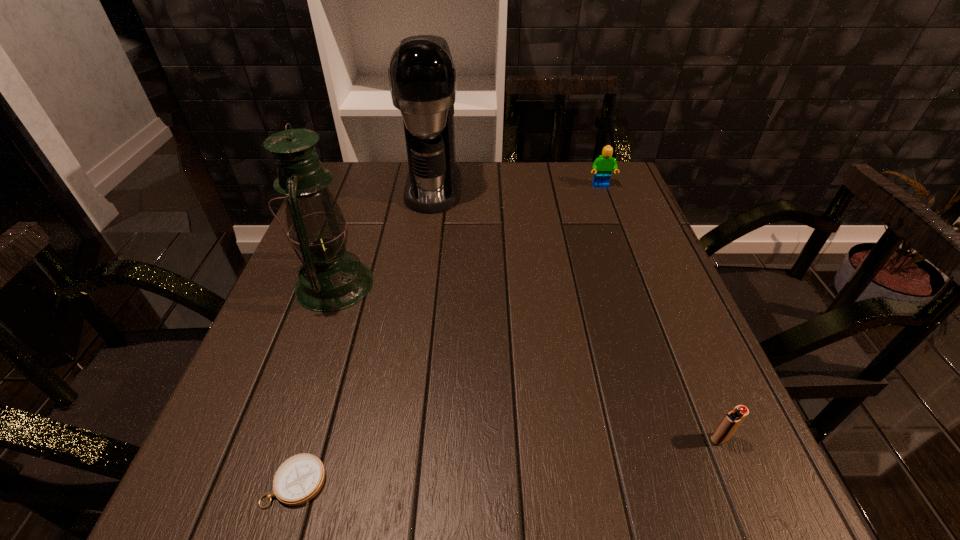
I want to click on the third object from right to left, so click(423, 81).

Identify the location of oil lamp. (331, 279).

Locate an element on the screen. the third tallest object is located at coordinates (603, 166).

The height and width of the screenshot is (540, 960). Find the location of `the fourth farthest object`. the fourth farthest object is located at coordinates coord(730,423).

Image resolution: width=960 pixels, height=540 pixels. What are the coordinates of `the fourth tallest object` in the screenshot? It's located at (730, 423).

Identify the location of the nearest object. This screenshot has height=540, width=960. (299, 479).

Where is `compass`? The image size is (960, 540). compass is located at coordinates (299, 479).

Identify the location of free point located 0.290m place cup under the spout of the coffee maker. This screenshot has height=540, width=960. pos(419,293).

You are a GUI agent. You are given a task and a screenshot of the screen. Output one action in this format:
    pyautogui.click(x=<x>, y=<y>)
    Task: Click on the free spot located on the back of the third farthest object
    The height and width of the screenshot is (540, 960).
    Given the screenshot: What is the action you would take?
    pyautogui.click(x=363, y=204)

Identify the location of free space located 0.380m on the face of the Lego. (637, 284).